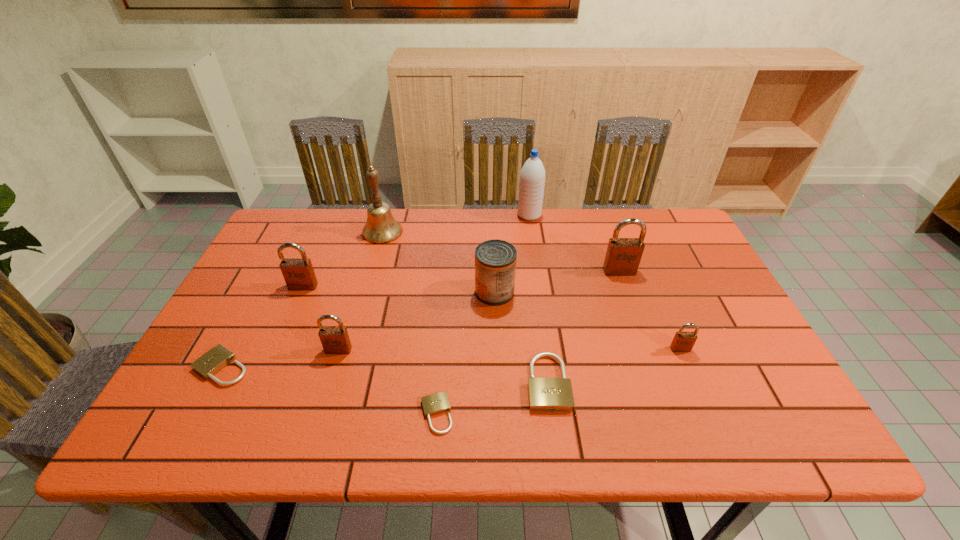
Where is `water bottle`? The image size is (960, 540). water bottle is located at coordinates (532, 177).

I want to click on bell, so click(x=381, y=227).

This screenshot has width=960, height=540. In order to click on the third farthest object in this screenshot , I will do `click(623, 255)`.

Locate an element on the screen. This screenshot has height=540, width=960. the third tallest object is located at coordinates (623, 255).

Identify the location of the third smallest brown padlock. (298, 273).

The width and height of the screenshot is (960, 540). I want to click on the second farthest padlock, so click(298, 273).

The width and height of the screenshot is (960, 540). Find the location of `the sixth object from left to right`. the sixth object from left to right is located at coordinates (495, 260).

Find the location of a particular element. The height and width of the screenshot is (540, 960). can is located at coordinates (495, 260).

You are a GUI agent. You are given a task and a screenshot of the screen. Output one action in this format:
    pyautogui.click(x=<x>, y=<y>)
    Task: Click on the fifth shortest padlock
    
    Given the screenshot: What is the action you would take?
    pyautogui.click(x=335, y=340)

Locate an element on the screen. This screenshot has width=960, height=540. the third brown padlock from right to left is located at coordinates (335, 340).